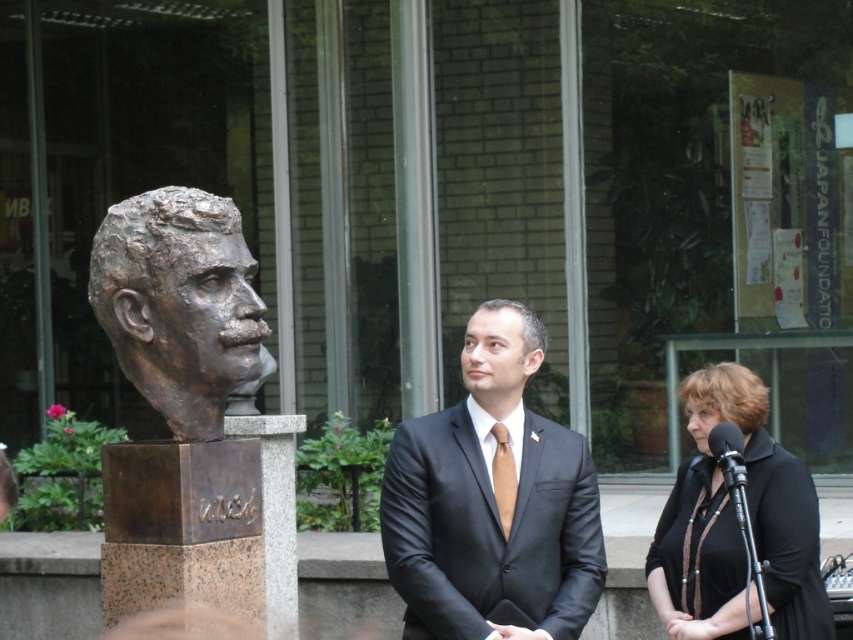
You are standing in the outdoor setting where the bronze bust is displayed. You notice a point marked at coordinates [500,353]. What object is located at that point?

The shiny bronze bust at center is located at point [500,353].

You are standing in front of the bronze bust and want to touch both the dark brown hair at center and the matte brown tie at center. Which one can you reach first without moving your position?

The dark brown hair at center is closer to the viewer than the matte brown tie at center, so you can reach it first without moving your position.

You are standing in front of the bronze bust on the pedestal. You notice two points marked in the scene at coordinates point (729, 374) and point (508, 438). Which of these points is nearer to your current position?

Point (729, 374) is closer to the camera than point (508, 438), so the point at (729, 374) is nearer to your current position.